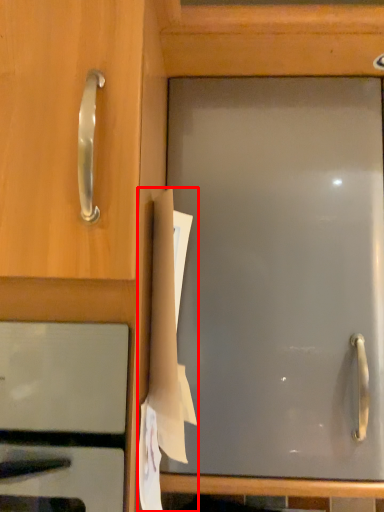
Question: From the image's perspective, where is paper (annotated by the red box) located relative to oven?

Choices:
 (A) above
 (B) below

Answer: (A)